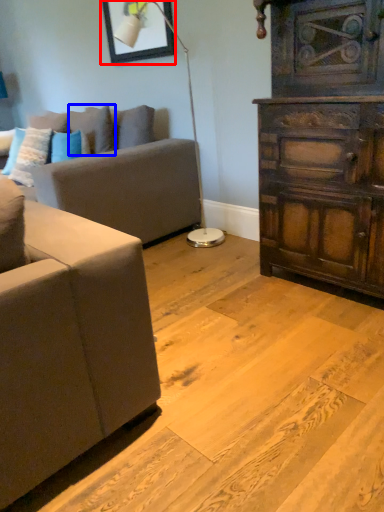
Question: Among these objects, which one is nearest to the camera, picture frame (highlighted by a red box) or pillow (highlighted by a blue box)?

Choices:
 (A) picture frame
 (B) pillow

Answer: (A)